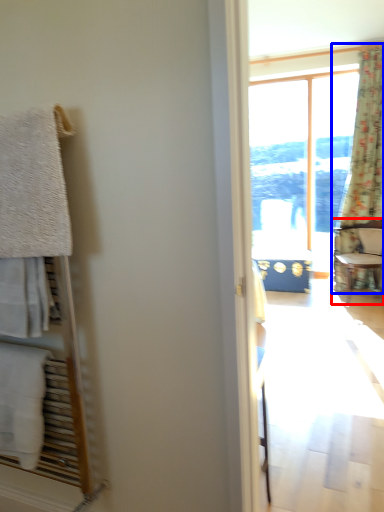
Question: Which point is closer to the camera, chair (highlighted by a red box) or curtain (highlighted by a blue box)?

Choices:
 (A) chair
 (B) curtain

Answer: (A)